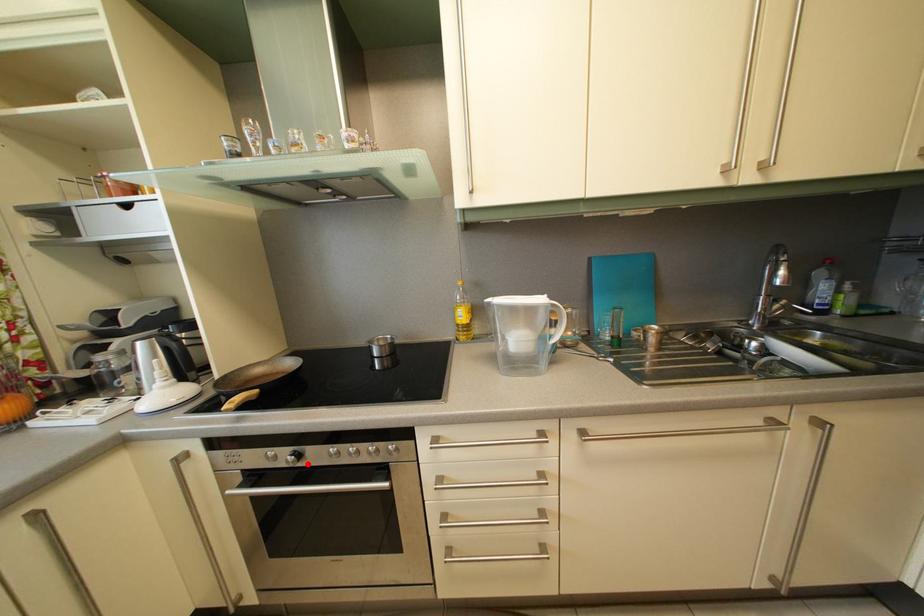
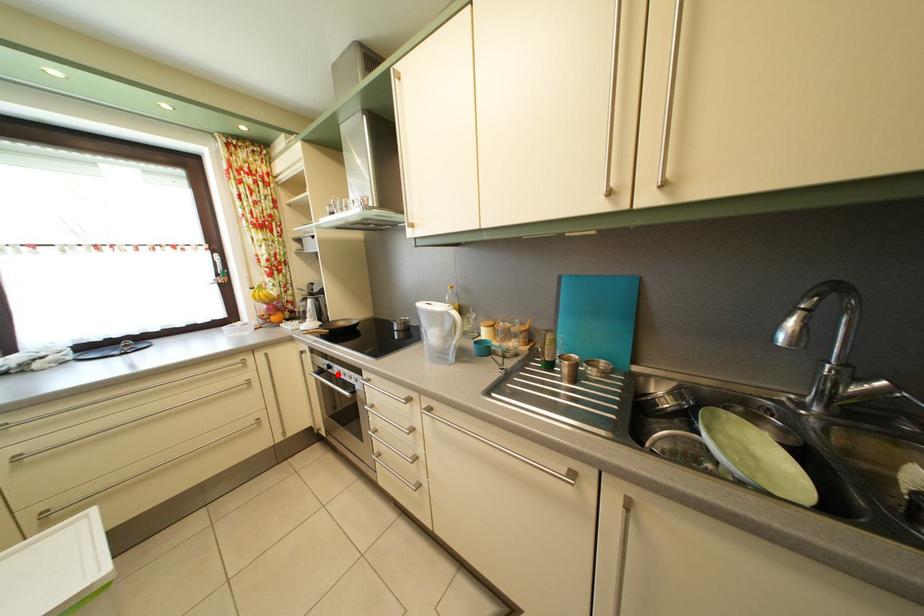
I am providing you with two images of the same scene from different viewpoints. A red point is marked on the first image and another point is marked on the second image. Do the highlighted points in image1 and image2 indicate the same real-world spot?

Yes